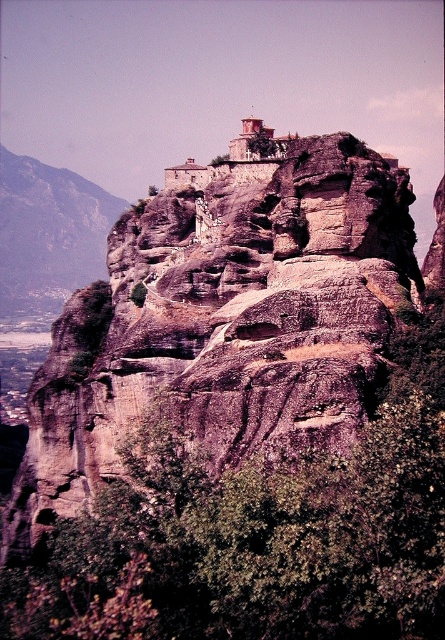
Question: Is rustic stone cliff at upper center wider than rugged stone mountain at left?

Choices:
 (A) no
 (B) yes

Answer: (B)

Question: Is rustic stone cliff at upper center positioned behind rugged stone mountain at left?

Choices:
 (A) no
 (B) yes

Answer: (A)

Question: Is rustic stone cliff at upper center wider than rugged stone mountain at left?

Choices:
 (A) no
 (B) yes

Answer: (B)

Question: Which object appears farthest from the camera in this image?

Choices:
 (A) rustic stone cliff at upper center
 (B) rugged stone mountain at left

Answer: (B)